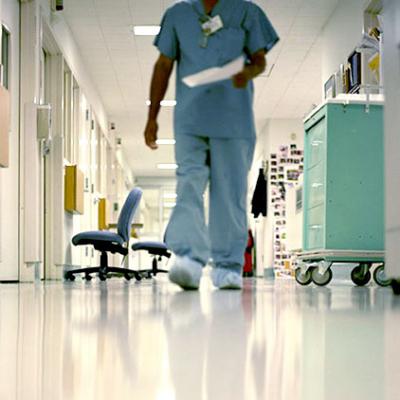
Locate an element on the screen. The image size is (400, 400). medical cart wheel is located at coordinates point(325,277), point(300,278), point(357,276), point(381,282).